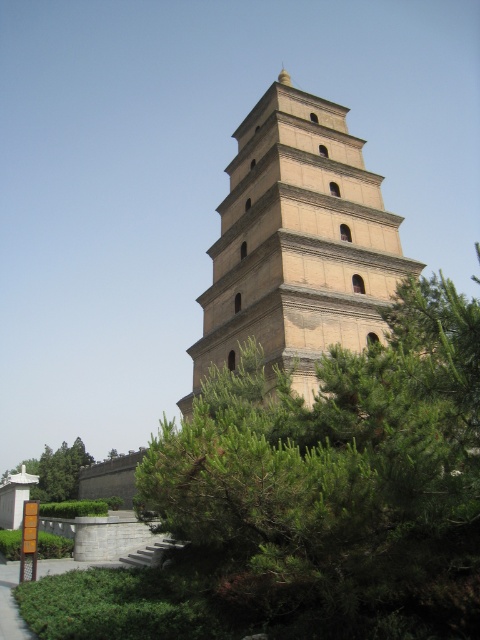
You are standing in front of the beige brick tower at center and the green leafy tree at lower left. Which object is taller?

The beige brick tower at center is much taller than the green leafy tree at lower left.

You are standing at the point marked by coordinates point (298,243). What structure are you facing?

The point (298,243) indicates that you are facing the beige brick tower at center.